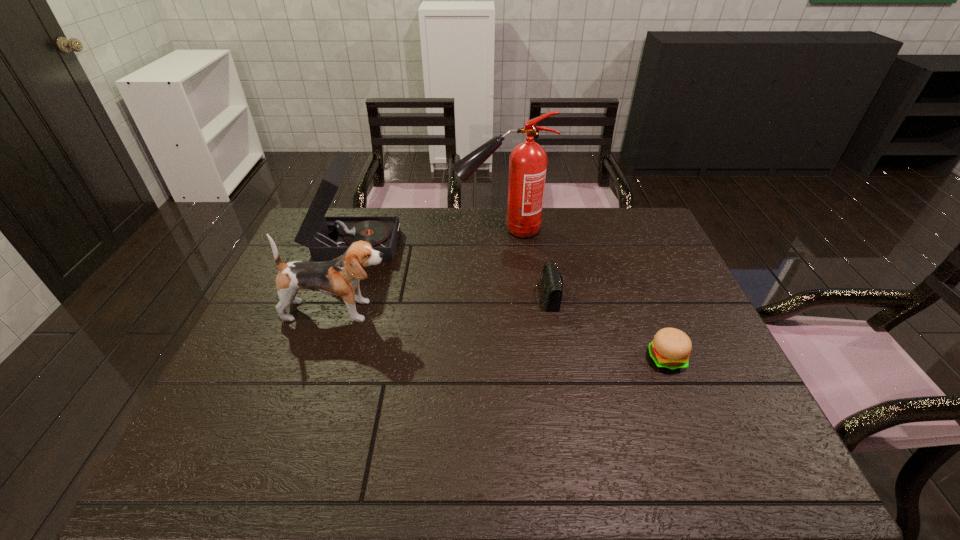
This screenshot has width=960, height=540. Find the location of `object present at the far left corner`. object present at the far left corner is located at coordinates (327, 238).

Image resolution: width=960 pixels, height=540 pixels. What are the coordinates of `free spot at the far edge of the desktop` in the screenshot? It's located at (433, 238).

Find the location of a particular element. free space at the near edge of the desktop is located at coordinates (625, 457).

Where is `free space at the left edge of the desktop`? free space at the left edge of the desktop is located at coordinates (267, 311).

What are the coordinates of `free location at the right edge` in the screenshot? It's located at (746, 414).

This screenshot has height=540, width=960. I want to click on vacant space that's between the phonograph_record and the nearest object, so click(x=510, y=300).

I want to click on vacant space that is in between the tallest object and the clutch bag, so (x=524, y=262).

I want to click on free space between the clutch bag and the phonograph_record, so click(450, 268).

Where is `unoccupied area between the puppy and the tallest object`? unoccupied area between the puppy and the tallest object is located at coordinates (420, 270).

Identify the location of free spot between the nearest object and the puppy. The height and width of the screenshot is (540, 960). (502, 335).